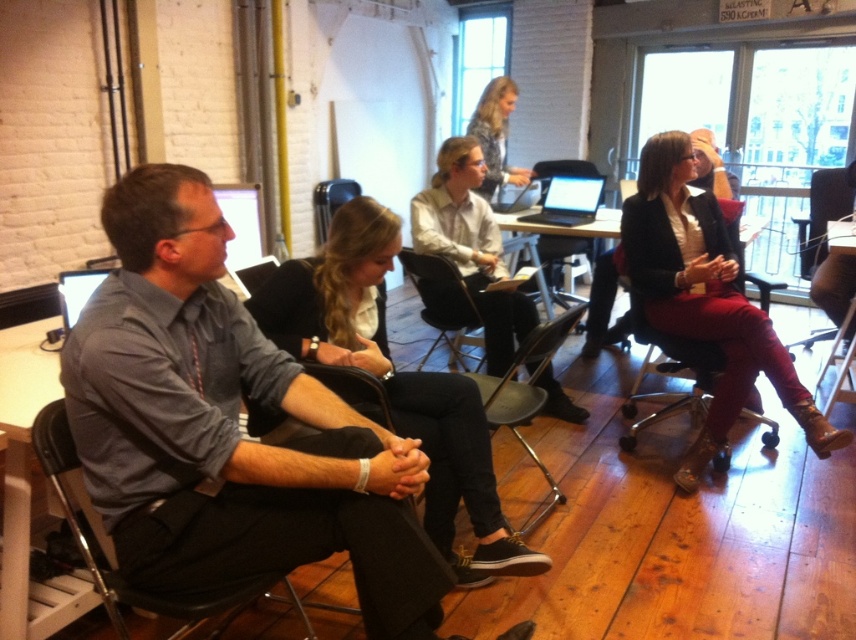
You are organizing a photo shoot and need to arrange two shirts for a model. The matte gray shirt at center and the white shirt at center are both available. If you want to place them side by side on a mannequin, which shirt should you choose if you want the one that takes up less space horizontally?

The matte gray shirt at center has a lesser width compared to the white shirt at center, so you should choose the matte gray shirt at center as it takes up less horizontal space.

You are organizing a workshop in this room and need to ensure there is enough space between the matte black blazer at center and the metallic silver chair at center for attendees to move comfortably. Based on their sizes, can you confirm if there is sufficient space between them?

The matte black blazer at center might be wider than the metallic silver chair at center, so there may not be enough space between them for attendees to move comfortably. Consider rearranging the seating to ensure adequate space.

You are a person with a 1.2 meter wide wheelchair. You want to move from the entrance to the back of the room where the presenter is standing. Is there enough space between the black leather pants at center and the metallic gray chair at center for your wheelchair to pass through?

The black leather pants at center might be wider than the metallic gray chair at center, so there is uncertainty about whether the wheelchair can pass through. It is recommended to check the actual width before attempting to navigate that path.